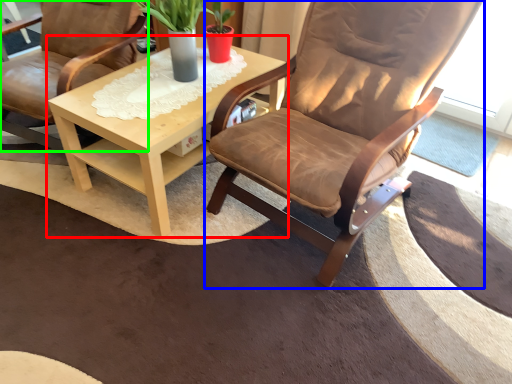
Question: Which object is the closest to the coffee table (highlighted by a red box)? Choose among these: chair (highlighted by a blue box) or chair (highlighted by a green box).

Choices:
 (A) chair
 (B) chair

Answer: (B)